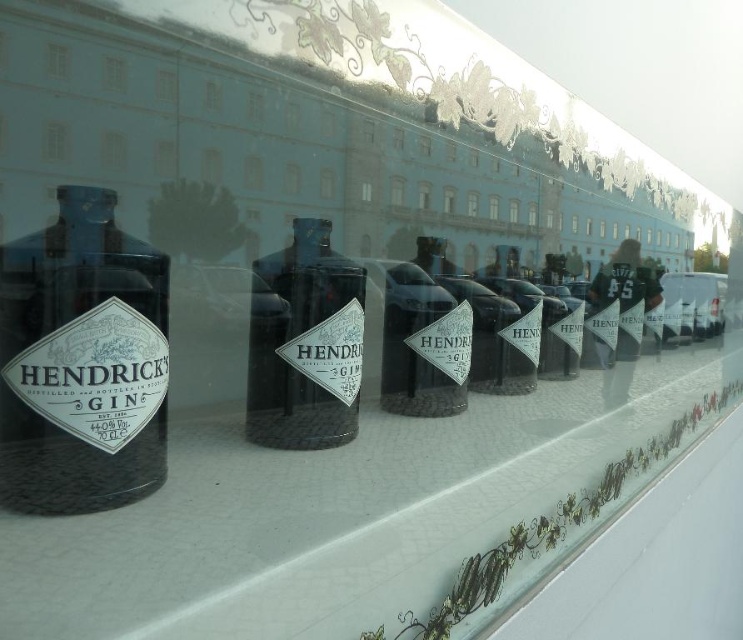
Question: Can you confirm if white textured surface at center is positioned to the left of matte glass hendrick's gin bottle at center?

Choices:
 (A) yes
 (B) no

Answer: (B)

Question: Which object is closer to the camera taking this photo?

Choices:
 (A) white textured surface at center
 (B) matte glass hendrick's gin bottle at center
 (C) matte black bottle at left
 (D) transparent glass window at upper left

Answer: (A)

Question: Considering the relative positions of white textured surface at center and transparent glass window at upper left in the image provided, where is white textured surface at center located with respect to transparent glass window at upper left?

Choices:
 (A) above
 (B) below

Answer: (B)

Question: Can you confirm if white textured surface at center is smaller than matte black bottle at left?

Choices:
 (A) no
 (B) yes

Answer: (A)

Question: Which object is closer to the camera taking this photo?

Choices:
 (A) white textured surface at center
 (B) matte black bottle at left
 (C) matte glass hendrick's gin bottle at center

Answer: (A)

Question: Estimate the real-world distances between objects in this image. Which object is closer to the matte black bottle at left?

Choices:
 (A) matte glass hendrick's gin bottle at center
 (B) white textured surface at center

Answer: (A)